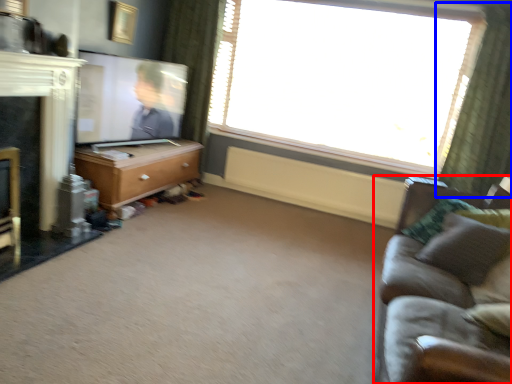
Question: Which object is closer to the camera taking this photo, studio couch (highlighted by a red box) or curtain (highlighted by a blue box)?

Choices:
 (A) studio couch
 (B) curtain

Answer: (A)